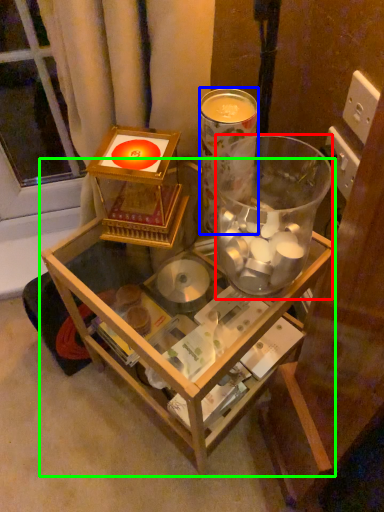
Question: Based on their relative distances, which object is farther from beverage (highlighted by a red box)? Choose from beverage (highlighted by a blue box) and table (highlighted by a green box).

Choices:
 (A) beverage
 (B) table

Answer: (B)